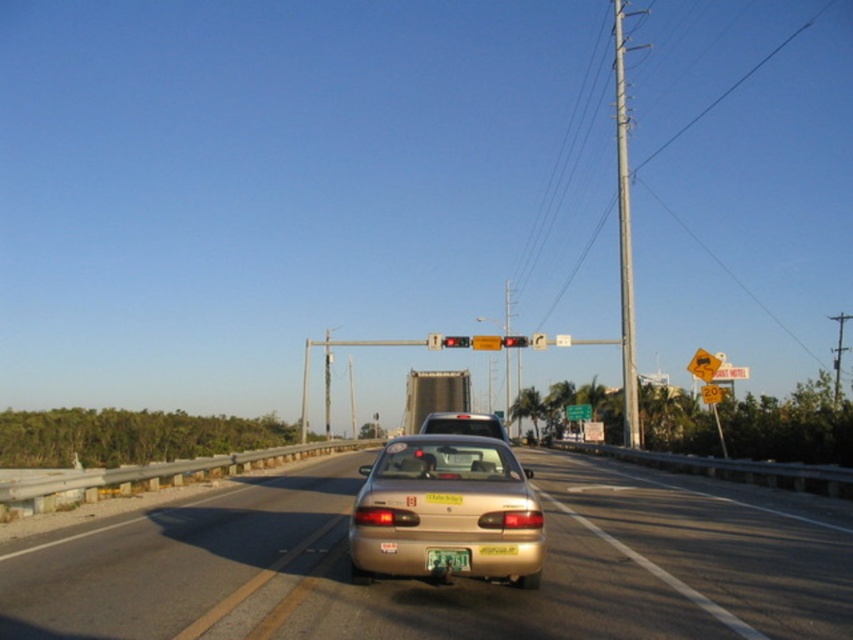
You are driving a car that is 1.8 meters wide and need to pass through the space between the gold matte sedan at center and the red glass traffic light at center. Can your car fit through that space?

The gold matte sedan at center is wider than the red glass traffic light at center, but the exact width of the space between them isn

You are driving a car and see two points on the road ahead. The first point is at coordinates point (x=428, y=570) and the second is at point (x=461, y=339). Which point is closer to your current position?

Point (x=428, y=570) is in front of point (x=461, y=339), so the point closer to your current position is point (x=461, y=339).

You are a driver approaching the traffic light and need to know if your car can fit between the green matte license plate at center and the red glass traffic light at center. The width of your car is 1.8 meters. Can you safely pass through?

The green matte license plate at center is narrower than the red glass traffic light at center. However, the question of whether your car can fit between them depends on the distance between these two objects. Since the description only provides information about their widths and not the spacing between them, it is impossible to determine if there is enough space for your car to pass safely. You should proceed with caution or stop to assess the situation visually.